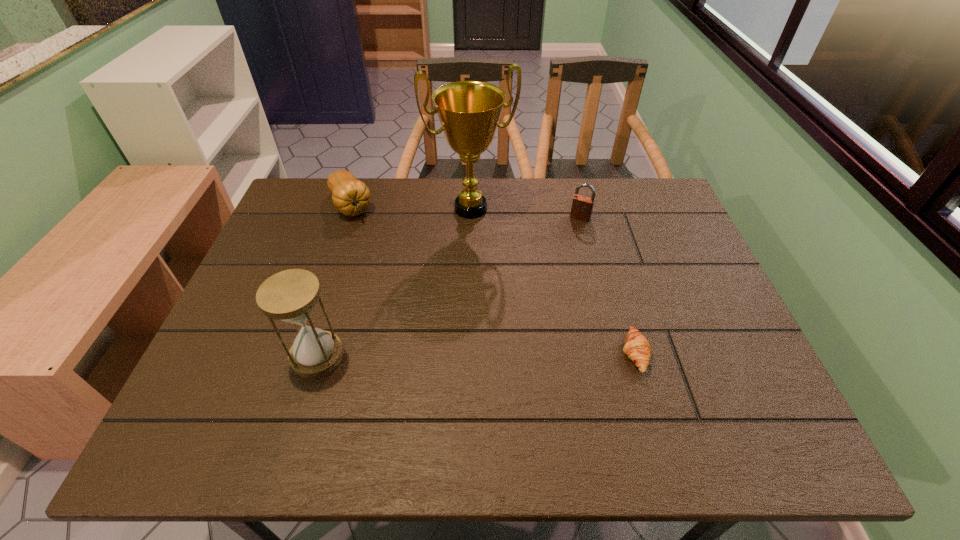
Locate an element on the screen. The image size is (960, 540). hourglass is located at coordinates (291, 295).

Find the location of a particular element. This screenshot has height=540, width=960. pastry is located at coordinates (637, 348).

This screenshot has width=960, height=540. Find the location of `padlock`. padlock is located at coordinates (582, 206).

Where is `gourd`? gourd is located at coordinates (351, 197).

Locate an element on the screen. the third object from left to right is located at coordinates (469, 111).

You are a GUI agent. You are given a task and a screenshot of the screen. Output one action in this format:
    pyautogui.click(x=<x>, y=<y>)
    Task: Click on the award
    This screenshot has height=540, width=960.
    Given the screenshot: What is the action you would take?
    pyautogui.click(x=469, y=111)

The width and height of the screenshot is (960, 540). In order to click on free space located on the right of the fourth shortest object in this screenshot , I will do `click(522, 356)`.

The image size is (960, 540). I want to click on vacant space located 0.140m on the front-facing side of the shortest object, so click(x=560, y=354).

You are a GUI agent. You are given a task and a screenshot of the screen. Output one action in this format:
    pyautogui.click(x=<x>, y=<y>)
    Task: Click on the vacant space located on the front-facing side of the shortest object
    This screenshot has height=540, width=960.
    Given the screenshot: What is the action you would take?
    pyautogui.click(x=555, y=354)

Identify the location of vacant region located on the front-facing side of the shortest object. The image size is (960, 540). (496, 354).